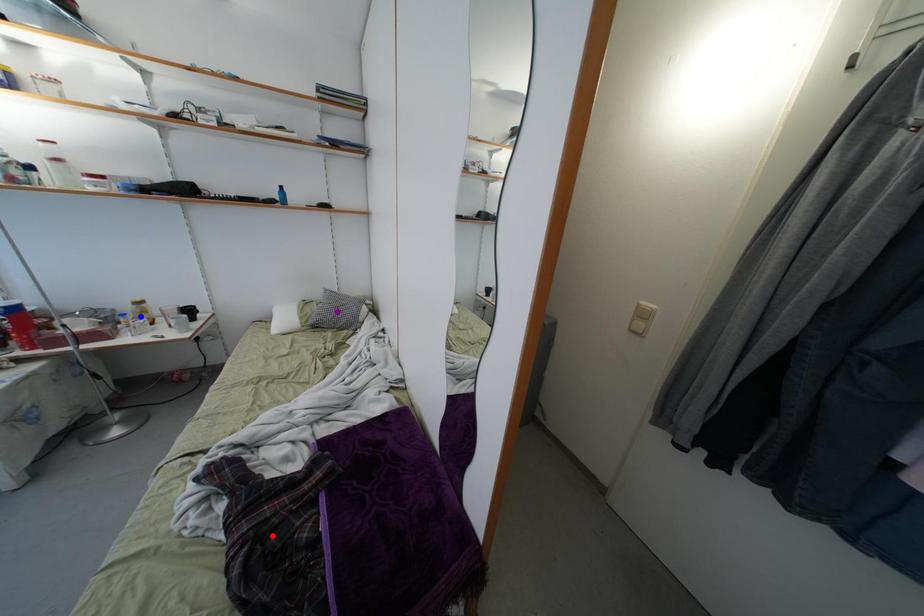
Order these from farthest to nearest:
A) blue point
B) red point
C) purple point

purple point
blue point
red point